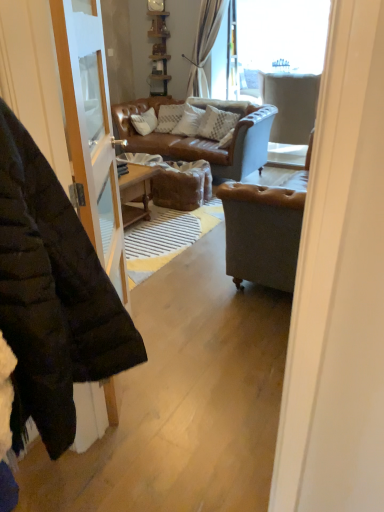
Question: Is textured beige pillow at center completely or partially outside of transparent glass window at upper center?

Choices:
 (A) no
 (B) yes

Answer: (B)

Question: Is textured beige pillow at center bigger than transparent glass window at upper center?

Choices:
 (A) yes
 (B) no

Answer: (B)

Question: From the image's perspective, is textured beige pillow at center located beneath transparent glass window at upper center?

Choices:
 (A) no
 (B) yes

Answer: (B)

Question: Does textured beige pillow at center have a greater width compared to transparent glass window at upper center?

Choices:
 (A) no
 (B) yes

Answer: (B)

Question: Considering the relative positions of textured beige pillow at center and transparent glass window at upper center in the image provided, is textured beige pillow at center to the right of transparent glass window at upper center from the viewer's perspective?

Choices:
 (A) no
 (B) yes

Answer: (A)

Question: In terms of height, does black puffer jacket at left look taller or shorter compared to light gray fabric armchair at upper right?

Choices:
 (A) short
 (B) tall

Answer: (B)

Question: Considering the positions of black puffer jacket at left and light gray fabric armchair at upper right in the image, is black puffer jacket at left bigger or smaller than light gray fabric armchair at upper right?

Choices:
 (A) big
 (B) small

Answer: (B)

Question: Considering the relative positions of black puffer jacket at left and light gray fabric armchair at upper right in the image provided, is black puffer jacket at left to the left or to the right of light gray fabric armchair at upper right?

Choices:
 (A) left
 (B) right

Answer: (A)

Question: From a real-world perspective, is black puffer jacket at left positioned above or below light gray fabric armchair at upper right?

Choices:
 (A) below
 (B) above

Answer: (B)

Question: From the image's perspective, is light gray fabric armchair at upper right positioned above or below textured beige pillow at center?

Choices:
 (A) below
 (B) above

Answer: (B)

Question: Considering the positions of point (284, 139) and point (200, 122), is point (284, 139) closer or farther from the camera than point (200, 122)?

Choices:
 (A) farther
 (B) closer

Answer: (A)

Question: Would you say light gray fabric armchair at upper right is inside or outside textured beige pillow at center?

Choices:
 (A) inside
 (B) outside

Answer: (B)

Question: From a real-world perspective, is light gray fabric armchair at upper right above or below textured beige pillow at center?

Choices:
 (A) above
 (B) below

Answer: (B)

Question: Is transparent glass window at upper center to the left or to the right of textured beige pillow at center in the image?

Choices:
 (A) left
 (B) right

Answer: (B)

Question: Is transparent glass window at upper center spatially inside textured beige pillow at center, or outside of it?

Choices:
 (A) inside
 (B) outside

Answer: (B)